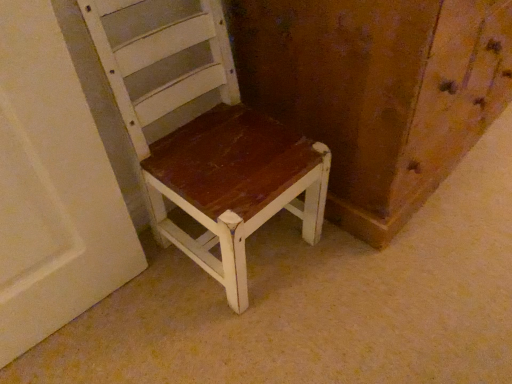
At what (x,y) coordinates should I click in order to perform the action: click on vacant area that lies in front of white wood chair at center. Please return your answer as a coordinate pair (x, y). Looking at the image, I should click on (227, 332).